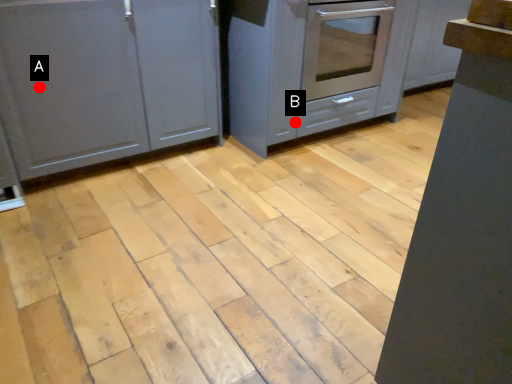
Question: Two points are circled on the image, labeled by A and B beside each circle. Which point is farther to the camera?

Choices:
 (A) A is further
 (B) B is further

Answer: (B)